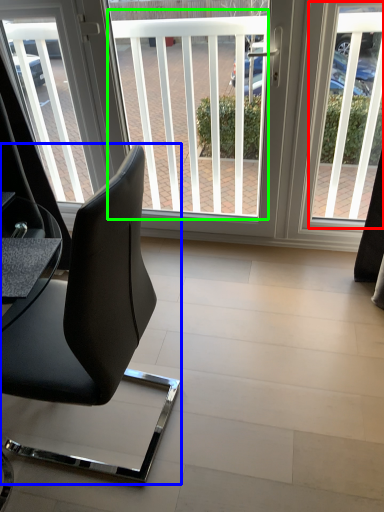
Question: Considering the real-world distances, which object is farthest from window screen (highlighted by a red box)? chair (highlighted by a blue box) or window screen (highlighted by a green box)?

Choices:
 (A) chair
 (B) window screen

Answer: (A)